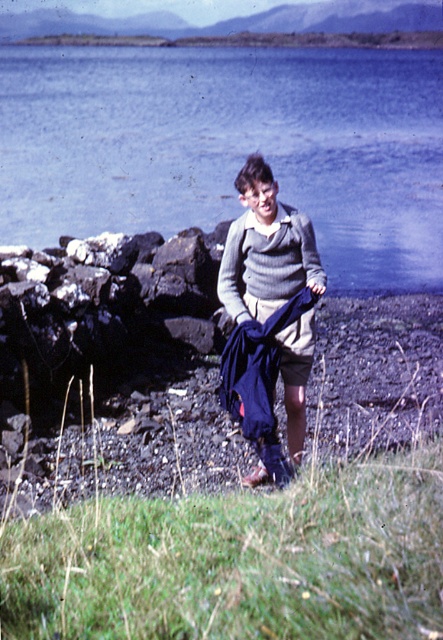
Which is below, blue water at center or knitted gray sweater at center?

knitted gray sweater at center

Is point (269, 97) positioned in front of point (257, 227)?

No, (269, 97) is behind (257, 227).

Find the location of a particular element. This screenshot has width=443, height=640. blue water at center is located at coordinates (229, 147).

Is knitted sweater at center smaller than knitted gray sweater at center?

Actually, knitted sweater at center might be larger than knitted gray sweater at center.

Is point (263, 273) positioned behind point (239, 288)?

No, it is not.

Who is more distant from viewer, (268, 307) or (253, 257)?

Positioned behind is point (268, 307).

The height and width of the screenshot is (640, 443). What are the coordinates of `knitted sweater at center` in the screenshot? It's located at (265, 250).

Find the location of a particular element. This screenshot has height=640, width=443. blue water at center is located at coordinates (229, 147).

Does blue water at center have a lesser height compared to knitted sweater at center?

No, blue water at center is not shorter than knitted sweater at center.

Locate an element on the screen. blue water at center is located at coordinates (229, 147).

Where is `blue water at center`? This screenshot has height=640, width=443. blue water at center is located at coordinates (229, 147).